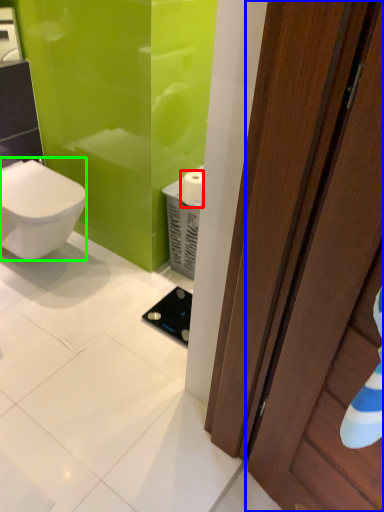
Question: Considering the real-world distances, which object is farthest from toilet paper (highlighted by a red box)? door (highlighted by a blue box) or bidet (highlighted by a green box)?

Choices:
 (A) door
 (B) bidet

Answer: (A)